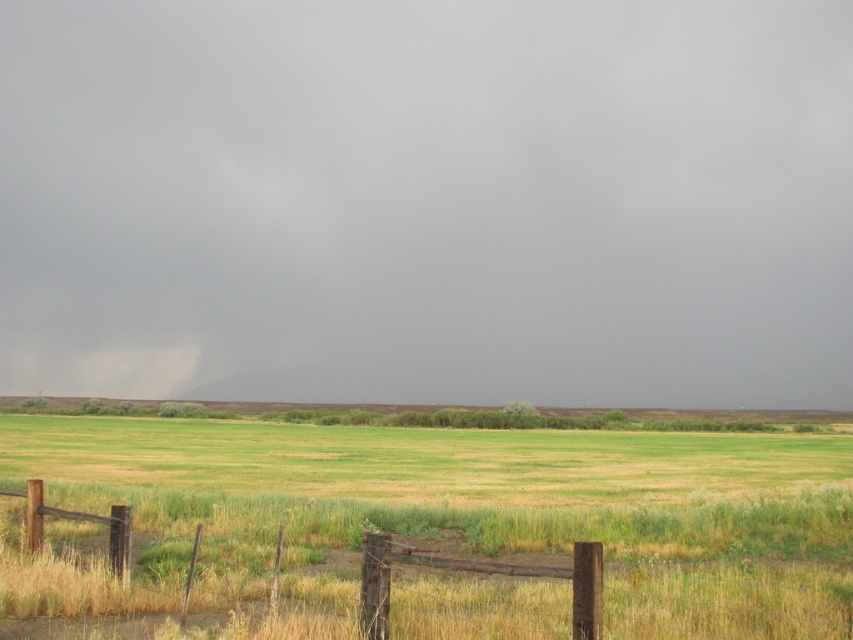
You are standing in the open field and want to take a photo of the dark gray cloud at center. Where exactly should you aim your camera?

You should aim your camera at point (437, 196) to capture the dark gray cloud at center.

You are standing at the center of the field and want to walk towards the wooden fence at lower center. Which direction should you walk?

You should walk towards the lower center direction to reach the wooden fence at lower center.

You are standing in the open field and see two points marked in the image. Which point is closer to you, point (724, 307) or point (833, 536)?

Point (724, 307) is further to the camera than point (833, 536), so the closer point to you is point (833, 536).